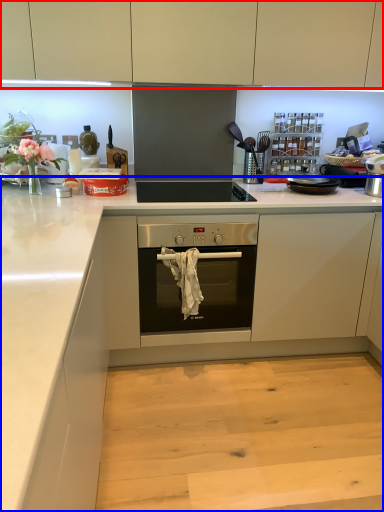
Question: Among these objects, which one is farthest to the camera, cabinetry (highlighted by a red box) or countertop (highlighted by a blue box)?

Choices:
 (A) cabinetry
 (B) countertop

Answer: (B)